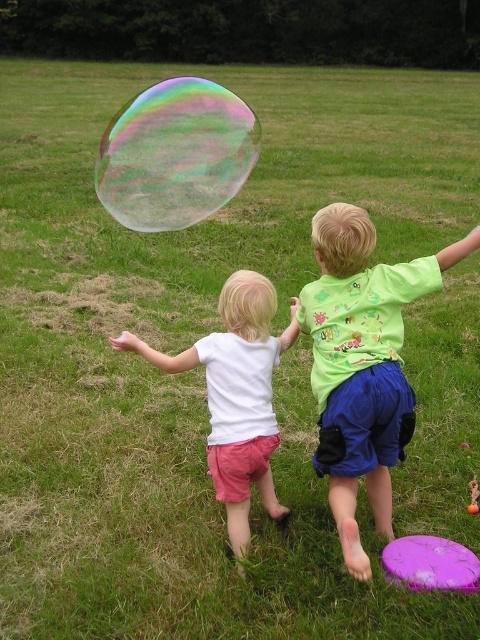
You are standing at the center of the grassy field and see the point at coordinates (362, 364). What object is located at that point?

The point at coordinates (362, 364) corresponds to the green cotton shirt at center.

You are a photographer trying to capture both the green cotton shirt at center and the transparent iridescent bubble at upper center in a single shot. Can you position yourself so that neither object is blocked by the other?

The green cotton shirt at center is in front of the transparent iridescent bubble at upper center, so positioning yourself so that neither blocks the other would be difficult. The bubble might appear faintly behind the shirt, but part of it could be obscured.

You are a photographer trying to capture the children playing with the bubble. You want to ensure both the green cotton shirt at center and the transparent iridescent bubble at upper center are clearly visible in your photo. Considering their sizes, which object might require you to adjust your camera focus more carefully?

The green cotton shirt at center has a smaller size compared to the transparent iridescent bubble at upper center, so the smaller green cotton shirt at center may require more careful focus adjustment to ensure clarity in the photo.